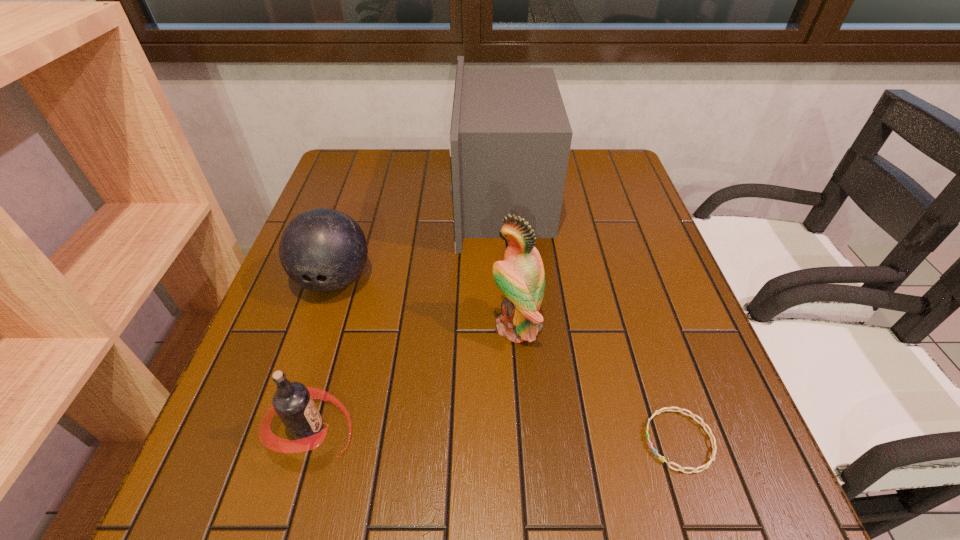
In the image, there is a desktop. What are the coordinates of `free region at the near left corner` in the screenshot? It's located at (275, 511).

Find the location of `free spot between the root beer and the shortest object`. free spot between the root beer and the shortest object is located at coordinates (494, 435).

Where is `empty space between the bowling ball and the microwave oven`? This screenshot has width=960, height=540. empty space between the bowling ball and the microwave oven is located at coordinates (419, 238).

At what (x,y) coordinates should I click in order to perform the action: click on empty space between the root beer and the parrot. Please return your answer as a coordinate pair (x, y). Image resolution: width=960 pixels, height=540 pixels. Looking at the image, I should click on (413, 378).

Find the location of a particular element. empty location between the bracelet and the parrot is located at coordinates (598, 383).

Locate an element on the screen. The image size is (960, 540). empty space between the farthest object and the bowling ball is located at coordinates (419, 238).

You are a GUI agent. You are given a task and a screenshot of the screen. Output one action in this format:
    pyautogui.click(x=<x>, y=<y>)
    Task: Click on the free spot between the shortest object and the parrot
    The height and width of the screenshot is (540, 960).
    Given the screenshot: What is the action you would take?
    pyautogui.click(x=598, y=383)

I want to click on object that stands as the fourth closest to the bowling ball, so click(x=705, y=466).

Where is `object that is the closest to the microwave oven`? object that is the closest to the microwave oven is located at coordinates [520, 277].